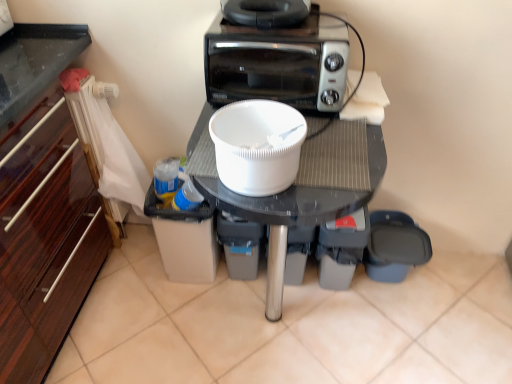
Find the location of a particular element. The width and height of the screenshot is (512, 384). empty space that is ontop of black plastic toaster at upper center (from a real-world perspective) is located at coordinates (280, 30).